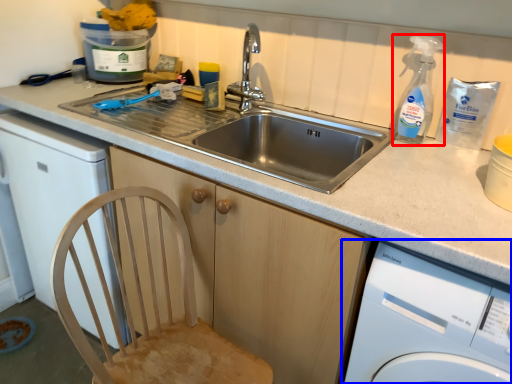
Question: Which point is further to the camera, cleaning product (highlighted by a red box) or washing machine (highlighted by a blue box)?

Choices:
 (A) cleaning product
 (B) washing machine

Answer: (A)